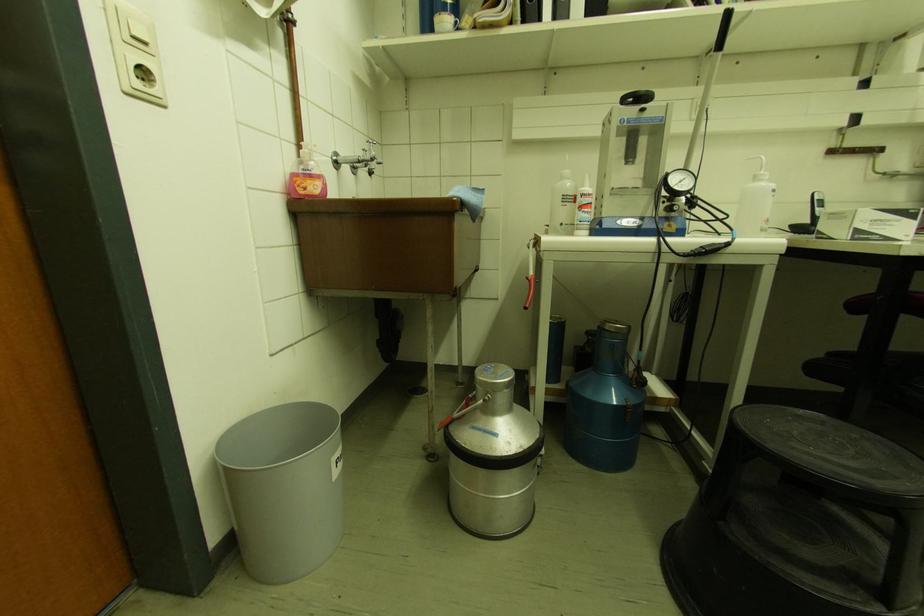
Find where to press the soap dispenser pump. Please return your answer as a coordinate pair (x, y).

(759, 169)